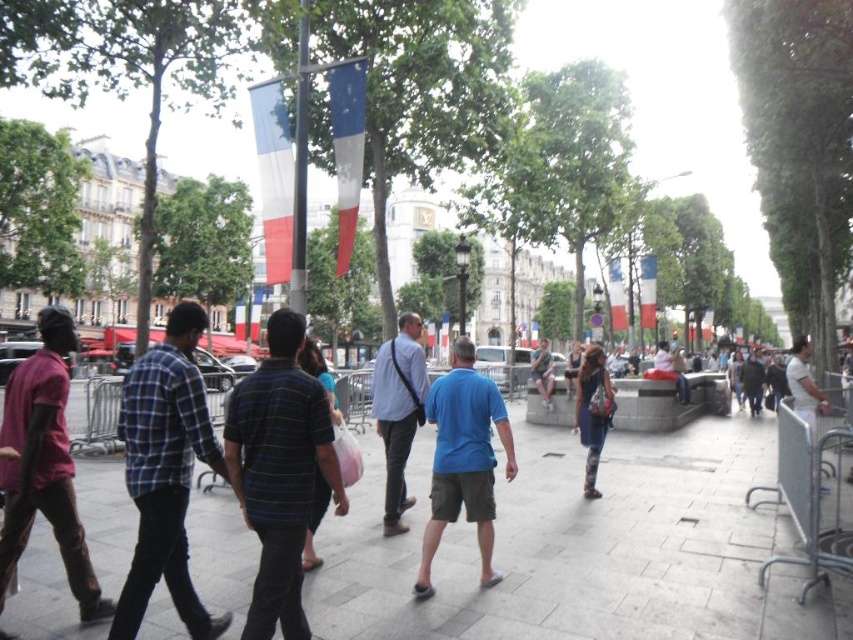
You are a GUI agent. You are given a task and a screenshot of the screen. Output one action in this format:
    pyautogui.click(x=<x>, y=<y>)
    Task: Click on the striped cotton shirt at center
    The image size is (853, 640).
    Given the screenshot: What is the action you would take?
    pyautogui.click(x=279, y=472)

Does striped cotton shirt at center lie in front of blue plaid shirt at left?

No, striped cotton shirt at center is further to the viewer.

This screenshot has width=853, height=640. Describe the element at coordinates (279, 472) in the screenshot. I see `striped cotton shirt at center` at that location.

The image size is (853, 640). In order to click on striped cotton shirt at center in this screenshot , I will do `click(279, 472)`.

Based on the photo, does blue plaid shirt at left have a lesser width compared to striped shirt at center?

Incorrect, blue plaid shirt at left's width is not less than striped shirt at center's.

Between point (166, 538) and point (303, 349), which one is positioned in front?

Point (166, 538) is more forward.

Identify the location of blue plaid shirt at left. The height and width of the screenshot is (640, 853). (165, 472).

Is gray concrete pavement at center smaller than denim shorts at center?

Incorrect, gray concrete pavement at center is not smaller in size than denim shorts at center.

Which of these two, gray concrete pavement at center or denim shorts at center, stands taller?

gray concrete pavement at center is taller.

Find the location of a particular element. The height and width of the screenshot is (640, 853). gray concrete pavement at center is located at coordinates (585, 547).